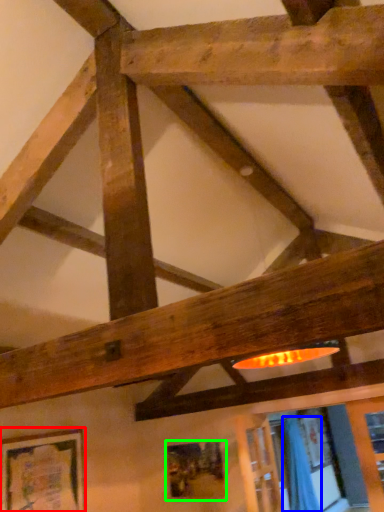
Question: Based on their relative distances, which object is nearer to picture frame (highlighted by a red box)? Choose from curtain (highlighted by a blue box) and picture frame (highlighted by a green box).

Choices:
 (A) curtain
 (B) picture frame

Answer: (B)